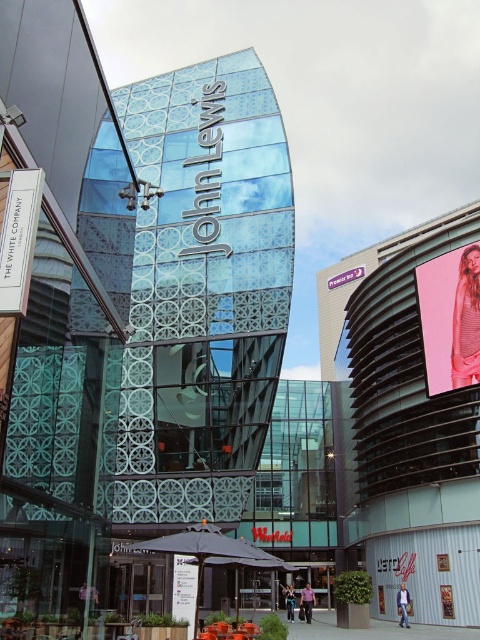
Question: Which of these objects is positioned closest to the matte white sign at center?

Choices:
 (A) white paper sign at lower left
 (B) pink fabric billboard at upper right

Answer: (A)

Question: Which object is positioned closest to the matte white sign at center?

Choices:
 (A) pink fabric billboard at upper right
 (B) white paper sign at lower left

Answer: (B)

Question: Observing the image, what is the correct spatial positioning of white paper sign at lower left in reference to matte white sign at center?

Choices:
 (A) above
 (B) below

Answer: (A)

Question: Is pink fabric billboard at upper right closer to the viewer compared to matte white sign at center?

Choices:
 (A) yes
 (B) no

Answer: (B)

Question: From the image, what is the correct spatial relationship of white paper sign at lower left in relation to matte white sign at center?

Choices:
 (A) below
 (B) above

Answer: (B)

Question: Estimate the real-world distances between objects in this image. Which object is farther from the matte white sign at center?

Choices:
 (A) pink fabric billboard at upper right
 (B) white paper sign at lower left

Answer: (A)